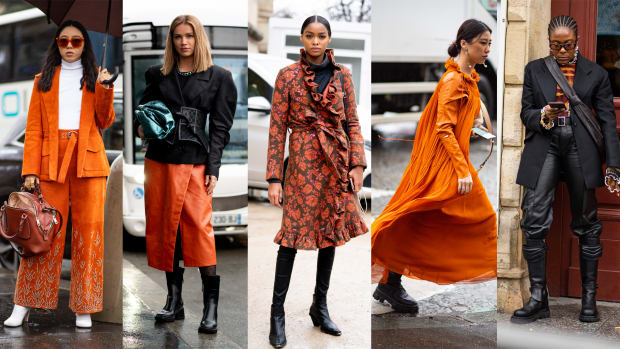
This screenshot has width=620, height=349. I want to click on brown wood door, so click(x=588, y=14).